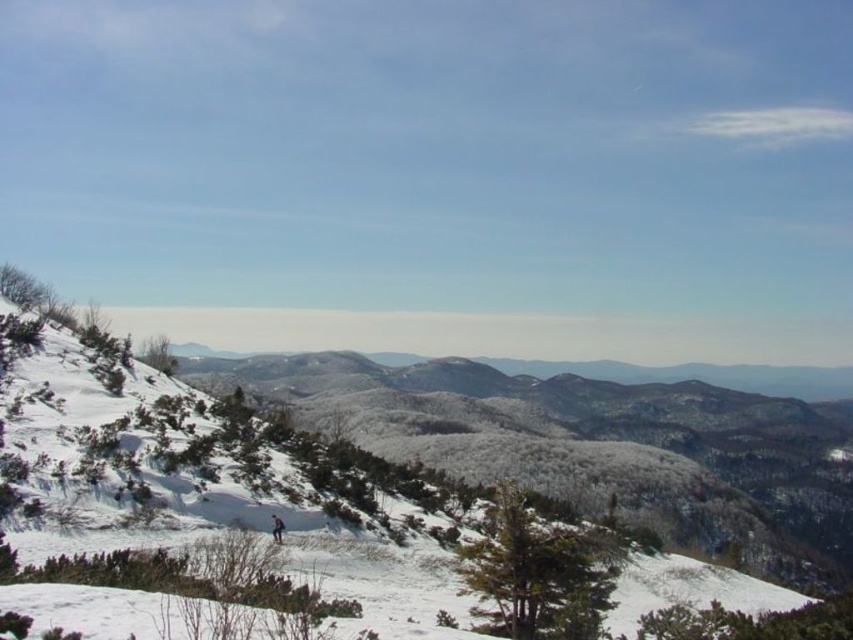
Question: Is white snow-covered mountain at left thinner than blue denim snowboarder at lower center?

Choices:
 (A) no
 (B) yes

Answer: (A)

Question: Which object appears closest to the camera in this image?

Choices:
 (A) white snow-covered mountain at left
 (B) blue denim snowboarder at lower center

Answer: (A)

Question: Which of the following is the closest to the observer?

Choices:
 (A) (279, 531)
 (B) (149, 369)

Answer: (A)

Question: Is white snow-covered mountain at left wider than blue denim snowboarder at lower center?

Choices:
 (A) no
 (B) yes

Answer: (B)

Question: Does white snow-covered mountain at left appear under blue denim snowboarder at lower center?

Choices:
 (A) no
 (B) yes

Answer: (B)